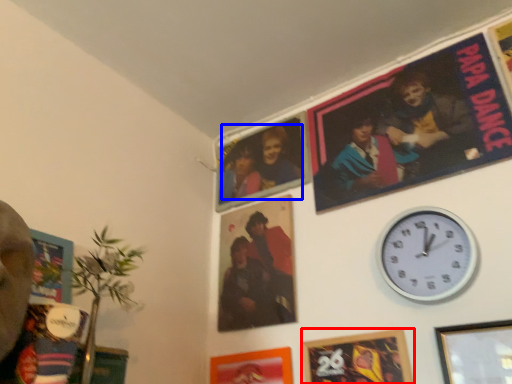
Question: Which of the following is the farthest to the observer, picture frame (highlighted by a red box) or couple (highlighted by a blue box)?

Choices:
 (A) picture frame
 (B) couple

Answer: (B)